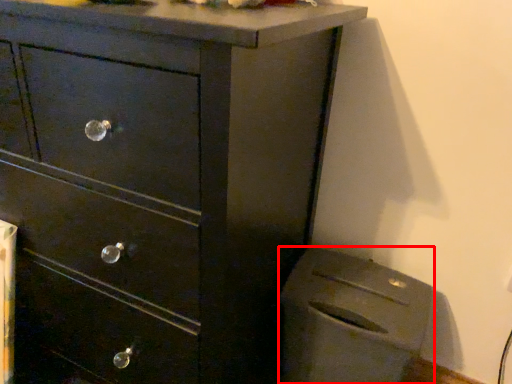
Question: Considering the relative positions of appliance (annotated by the red box) and chest of drawers in the image provided, where is appliance (annotated by the red box) located with respect to the staircase?

Choices:
 (A) right
 (B) left

Answer: (A)